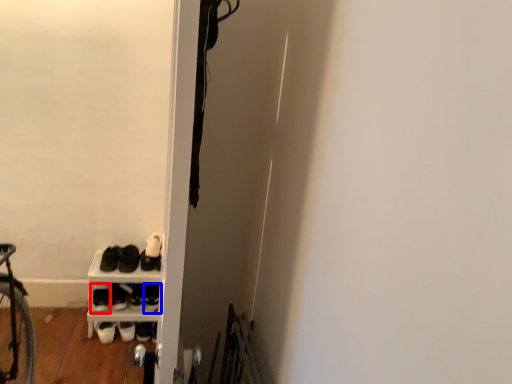
Question: Which object appears farthest to the camera in this image, footwear (highlighted by a red box) or footwear (highlighted by a blue box)?

Choices:
 (A) footwear
 (B) footwear

Answer: (B)